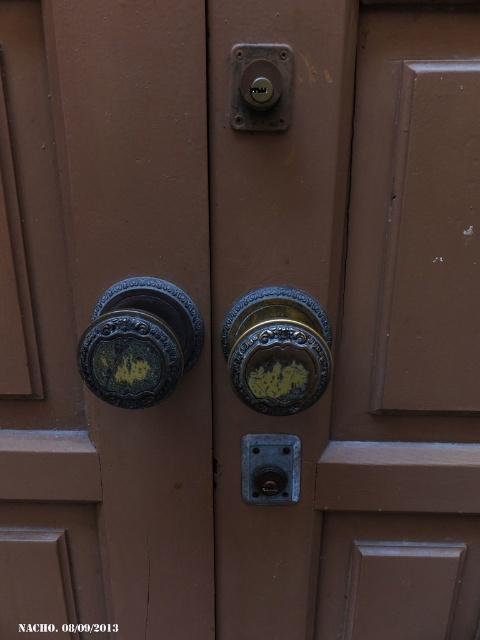
Question: Can you confirm if green patina brass doorknob at center is positioned below matte black lock at center?

Choices:
 (A) no
 (B) yes

Answer: (A)

Question: Which point is farther to the camera?

Choices:
 (A) (260, 67)
 (B) (265, 470)

Answer: (B)

Question: Is green patina brass doorknob at center in front of green patina metal at left?

Choices:
 (A) no
 (B) yes

Answer: (A)

Question: Is gold ornate door handle at center above matte brass lock at upper center?

Choices:
 (A) yes
 (B) no

Answer: (B)

Question: Which is farther from the gold ornate door handle at center?

Choices:
 (A) matte brass lock at upper center
 (B) green patina metal at left
 (C) green patina brass doorknob at center

Answer: (A)

Question: Among these objects, which one is nearest to the camera?

Choices:
 (A) matte brass doorbell at center
 (B) matte brass lock at upper center
 (C) green patina metal at left

Answer: (C)